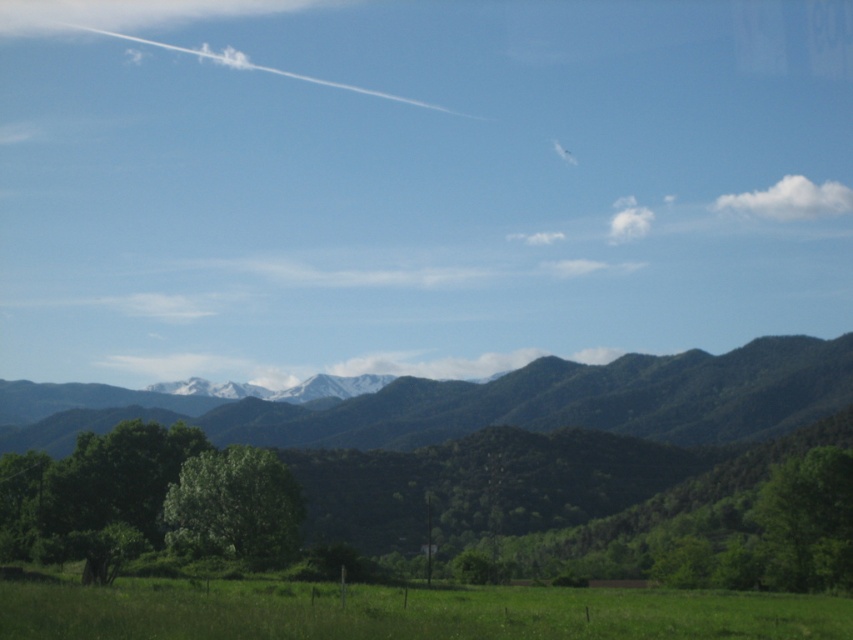
Between point (581, 381) and point (184, 538), which one is positioned in front?

Positioned in front is point (184, 538).

Consider the image. Which is below, green leafy mountains at center or green leafy tree at lower left?

green leafy mountains at center is below.

Which is behind, point (425, 404) or point (194, 520)?

The point (425, 404) is behind.

Where is `green leafy mountains at center`? The image size is (853, 640). green leafy mountains at center is located at coordinates (514, 435).

Which is behind, point (657, 600) or point (766, 529)?

The point (766, 529) is behind.

What do you see at coordinates (407, 612) in the screenshot? I see `green grassy field at lower center` at bounding box center [407, 612].

Does point (326, 612) come closer to viewer compared to point (785, 508)?

Yes.

What are the coordinates of `green grassy field at lower center` in the screenshot? It's located at (407, 612).

Is green leafy mountains at center taller than green leafy forest at center?

Correct, green leafy mountains at center is much taller as green leafy forest at center.

Between green leafy mountains at center and green leafy forest at center, which one appears on the left side from the viewer's perspective?

green leafy mountains at center is more to the left.

Identify the location of green leafy mountains at center. (514, 435).